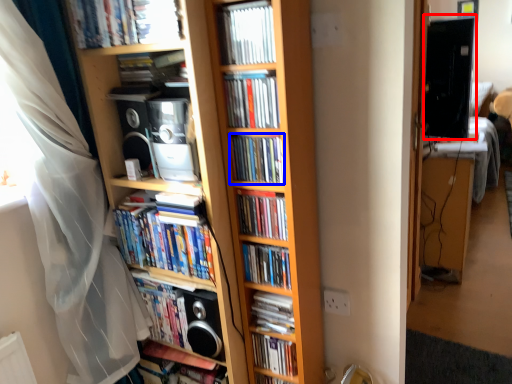
Question: Which of the following is the closest to the observer, computer monitor (highlighted by a red box) or book (highlighted by a blue box)?

Choices:
 (A) computer monitor
 (B) book

Answer: (B)